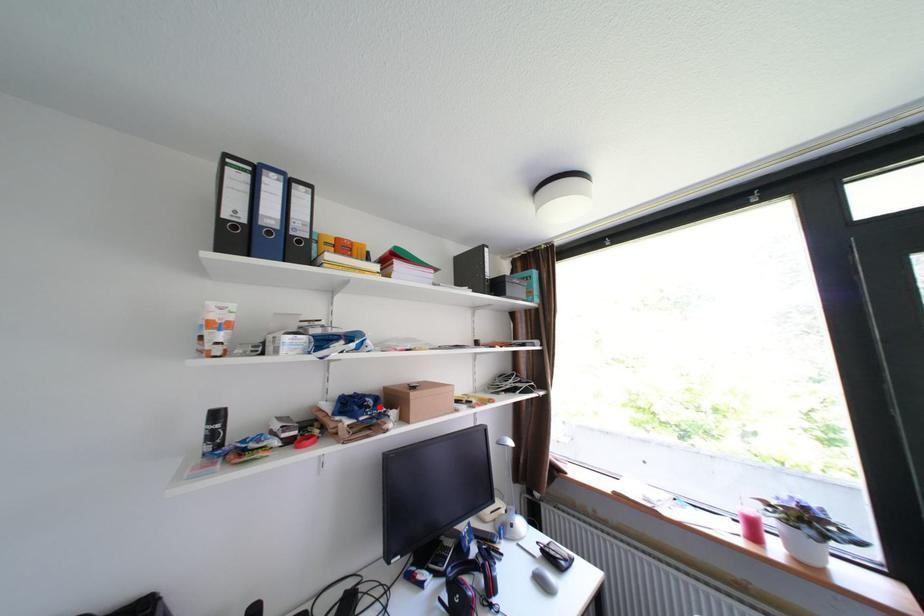
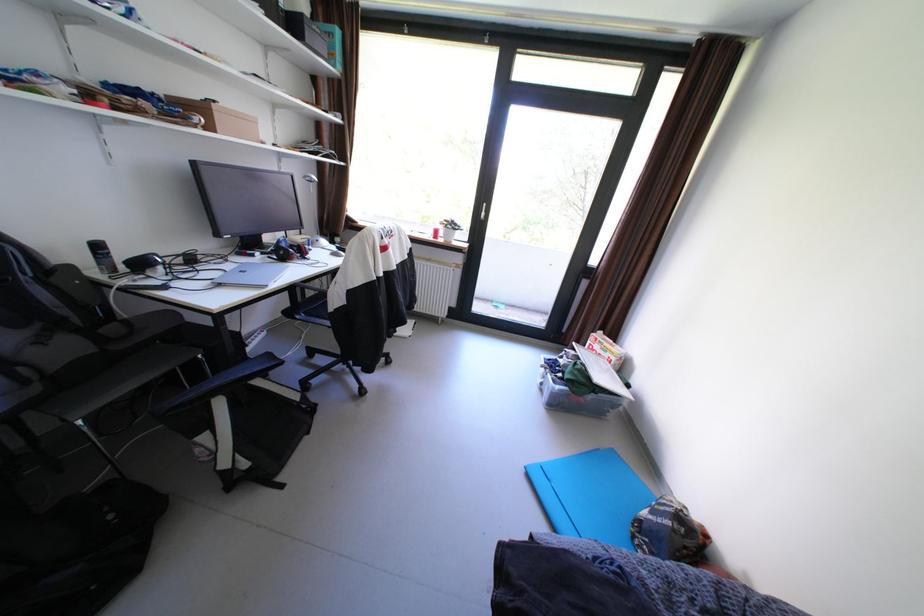
In the second image, find the point that corresponds to the highlighted location in the first image.

(172, 100)